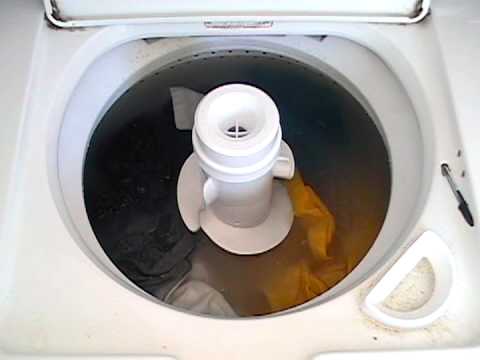
The height and width of the screenshot is (360, 480). In order to click on washer lid in this screenshot , I will do `click(222, 7)`.